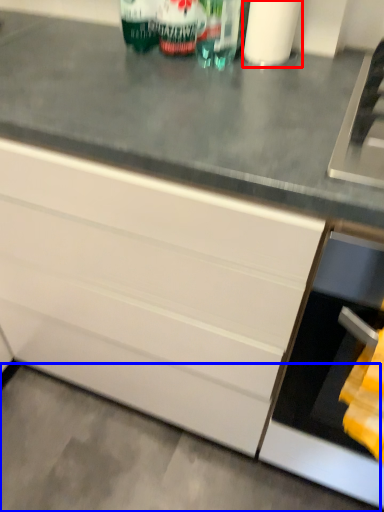
Question: Among these objects, which one is nearest to the camera, toilet paper (highlighted by a red box) or concrete (highlighted by a blue box)?

Choices:
 (A) toilet paper
 (B) concrete

Answer: (A)